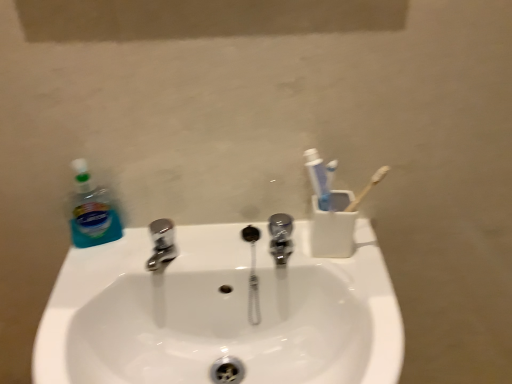
Question: Considering the positions of white glossy sink at center and white plastic toothbrush holder at upper right in the image, is white glossy sink at center taller or shorter than white plastic toothbrush holder at upper right?

Choices:
 (A) short
 (B) tall

Answer: (B)

Question: Would you say white glossy sink at center is inside or outside white plastic toothbrush holder at upper right?

Choices:
 (A) outside
 (B) inside

Answer: (A)

Question: Estimate the real-world distances between objects in this image. Which object is closer to the white glossy sink at center?

Choices:
 (A) white plastic toothbrush holder at upper right
 (B) polished chrome tap at center
 (C) blue translucent liquid at left

Answer: (B)

Question: Which object is the farthest from the blue translucent liquid at left?

Choices:
 (A) white plastic toothbrush holder at upper right
 (B) polished chrome tap at center
 (C) white glossy sink at center

Answer: (A)